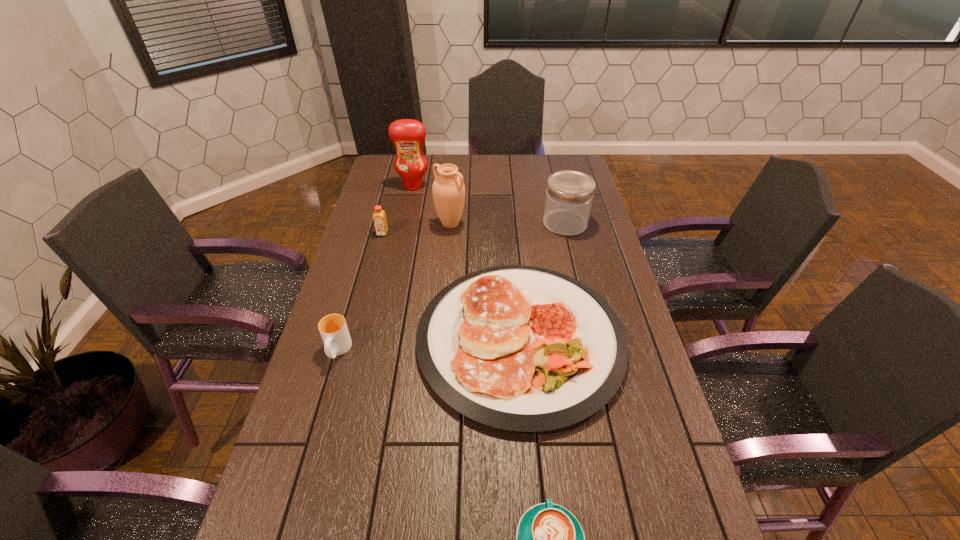
The image size is (960, 540). Find the location of `vacant position at the far edge of the desktop`. vacant position at the far edge of the desktop is located at coordinates (501, 175).

In the image, there is a desktop. At what (x,y) coordinates should I click in order to perform the action: click on vacant space at the left edge. Please return your answer as a coordinate pair (x, y). Looking at the image, I should click on pyautogui.click(x=384, y=280).

The width and height of the screenshot is (960, 540). What are the coordinates of `free space at the right edge` in the screenshot? It's located at (640, 517).

I want to click on free space between the urn and the condiment, so click(432, 205).

Identify the location of vacant area between the tallest object and the dish. This screenshot has width=960, height=540. (467, 262).

Where is `vacant space that's between the sixth shortest object and the cup`? The width and height of the screenshot is (960, 540). vacant space that's between the sixth shortest object and the cup is located at coordinates (394, 287).

Find the location of a particular element. unoccupied position between the condiment and the orange juice is located at coordinates (398, 210).

You are a GUI agent. You are given a task and a screenshot of the screen. Output one action in this format:
    pyautogui.click(x=<x>, y=<y>)
    Task: Click on the empty location between the orange juice and the urn
    The width and height of the screenshot is (960, 540).
    Given the screenshot: What is the action you would take?
    pyautogui.click(x=417, y=228)

Choose which object is the sixth nearest neighbor to the fourth tallest object. Please provide its 2D coordinates. Your answer should be formatted as a tuple, i.e. [(x, y)], where the tuple contains the x and y coordinates of a point satisfying the conditions above.

[(549, 539)]

Locate which object is the closest to the orange juice. Please provide its 2D coordinates. Your answer should be formatted as a tuple, i.e. [(x, y)], where the tuple contains the x and y coordinates of a point satisfying the conditions above.

[(448, 190)]